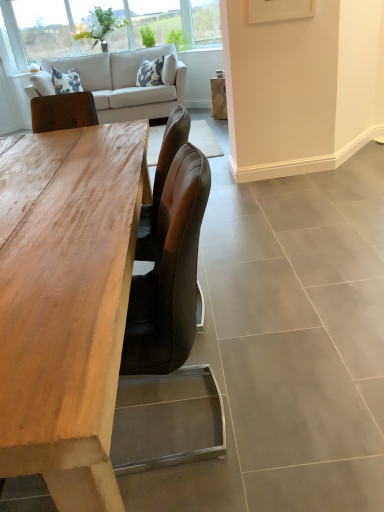
Question: From a real-world perspective, is light beige fabric couch at upper left on wooden table at center?

Choices:
 (A) yes
 (B) no

Answer: (A)

Question: Can you confirm if light beige fabric couch at upper left is taller than wooden table at center?

Choices:
 (A) yes
 (B) no

Answer: (A)

Question: Is light beige fabric couch at upper left completely or partially outside of wooden table at center?

Choices:
 (A) no
 (B) yes

Answer: (B)

Question: Is wooden table at center at the back of light beige fabric couch at upper left?

Choices:
 (A) no
 (B) yes

Answer: (A)

Question: Does light beige fabric couch at upper left have a greater width compared to wooden table at center?

Choices:
 (A) yes
 (B) no

Answer: (B)

Question: Is clear glass window at upper left spatially inside light beige fabric couch at upper left, or outside of it?

Choices:
 (A) inside
 (B) outside

Answer: (B)

Question: Is clear glass window at upper left taller or shorter than light beige fabric couch at upper left?

Choices:
 (A) tall
 (B) short

Answer: (B)

Question: Is point (8, 58) positioned closer to the camera than point (127, 118)?

Choices:
 (A) farther
 (B) closer

Answer: (B)

Question: Considering the relative positions of clear glass window at upper left and light beige fabric couch at upper left in the image provided, is clear glass window at upper left to the left or to the right of light beige fabric couch at upper left?

Choices:
 (A) left
 (B) right

Answer: (A)

Question: Considering the positions of point tap(18, 61) and point tap(117, 505), is point tap(18, 61) closer or farther from the camera than point tap(117, 505)?

Choices:
 (A) closer
 (B) farther

Answer: (B)

Question: Considering their positions, is clear glass window at upper left located in front of or behind wooden table at center?

Choices:
 (A) behind
 (B) front

Answer: (A)

Question: Would you say clear glass window at upper left is inside or outside wooden table at center?

Choices:
 (A) inside
 (B) outside

Answer: (B)

Question: Is clear glass window at upper left wider or thinner than wooden table at center?

Choices:
 (A) thin
 (B) wide

Answer: (A)

Question: In the image, is light beige fabric couch at upper left on the left side or the right side of wooden table at center?

Choices:
 (A) left
 (B) right

Answer: (A)

Question: Relative to wooden table at center, is light beige fabric couch at upper left in front or behind?

Choices:
 (A) behind
 (B) front

Answer: (A)